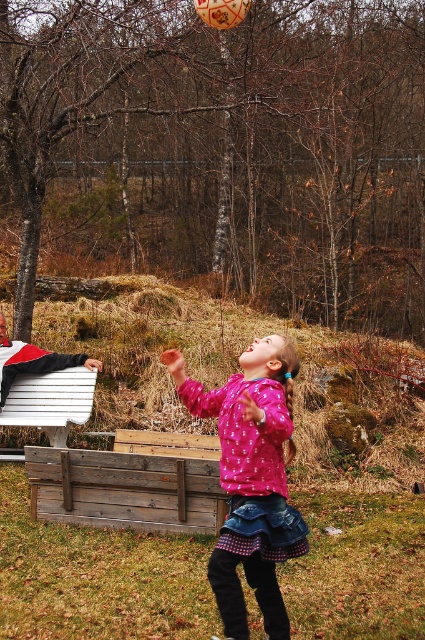
The height and width of the screenshot is (640, 425). Describe the element at coordinates (251, 477) in the screenshot. I see `pink matte sweater at center` at that location.

Which is more to the left, pink matte sweater at center or white wood park bench at lower left?

Positioned to the left is white wood park bench at lower left.

Describe the element at coordinates (251, 477) in the screenshot. This screenshot has width=425, height=640. I see `pink matte sweater at center` at that location.

Where is `pink matte sweater at center`? pink matte sweater at center is located at coordinates (251, 477).